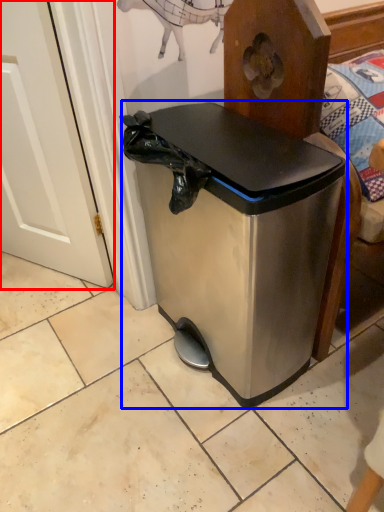
Question: Among these objects, which one is farthest to the camera, screen door (highlighted by a red box) or waste container (highlighted by a blue box)?

Choices:
 (A) screen door
 (B) waste container

Answer: (A)